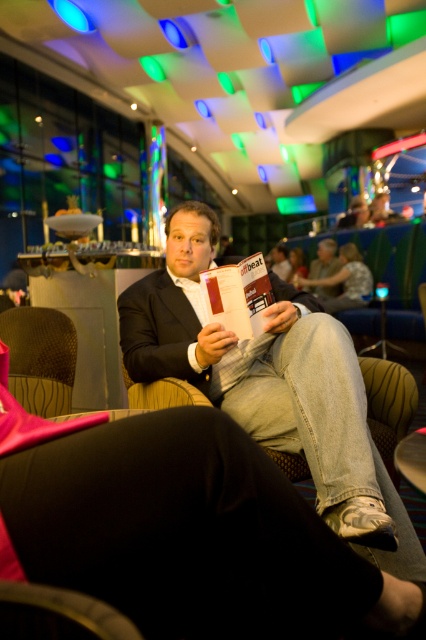
You are a delivery person trying to place a small package between the matte black jacket at center and the brown textured armchair at lower left. The package is 50 centimeters long. Can you fit it in the space between them?

The space between the matte black jacket at center and the brown textured armchair at lower left is only 47.44 centimeters, which is shorter than the 50 centimeter package. Therefore, the package cannot fit in that space.

You are standing in the lounge and want to place a small plant pot on the floor next to the matte black jacket at center. According to the coordinates provided, where should you place the pot?

The matte black jacket at center is located at coordinates point (268, 380), so you should place the small plant pot on the floor near that position.